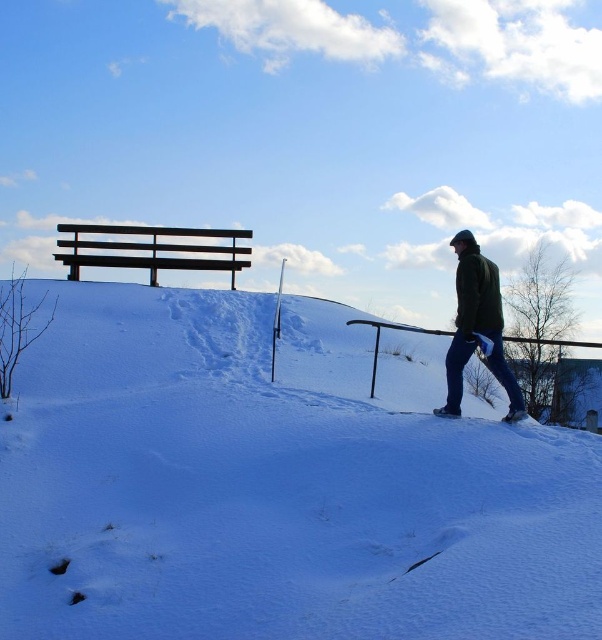
Which is above, white powdery snow at lower center or dark brown wooden bench at upper left?

dark brown wooden bench at upper left is higher up.

Can you confirm if white powdery snow at lower center is positioned above dark brown wooden bench at upper left?

No, white powdery snow at lower center is not above dark brown wooden bench at upper left.

What do you see at coordinates (276, 484) in the screenshot? The width and height of the screenshot is (602, 640). I see `white powdery snow at lower center` at bounding box center [276, 484].

Locate an element on the screen. This screenshot has width=602, height=640. white powdery snow at lower center is located at coordinates (276, 484).

Can you confirm if dark green jacket at right is taller than dark brown wooden bench at upper left?

Correct, dark green jacket at right is much taller as dark brown wooden bench at upper left.

Image resolution: width=602 pixels, height=640 pixels. What are the coordinates of `dark green jacket at right` in the screenshot? It's located at (476, 326).

From the picture: Does white powdery snow at lower center have a greater width compared to dark green jacket at right?

In fact, white powdery snow at lower center might be narrower than dark green jacket at right.

Who is positioned more to the right, white powdery snow at lower center or dark green jacket at right?

dark green jacket at right

This screenshot has width=602, height=640. I want to click on white powdery snow at lower center, so click(x=276, y=484).